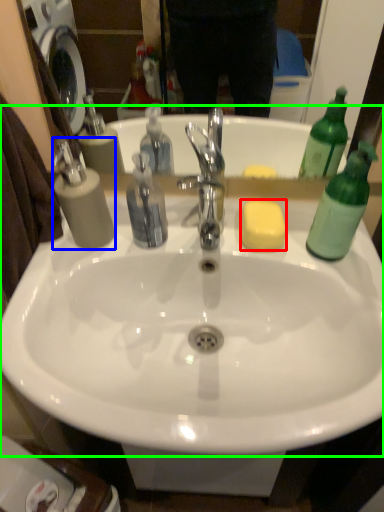
Question: Which is nearer to the soap (highlighted by a red box)? soap dispenser (highlighted by a blue box) or sink (highlighted by a green box).

Choices:
 (A) soap dispenser
 (B) sink

Answer: (B)